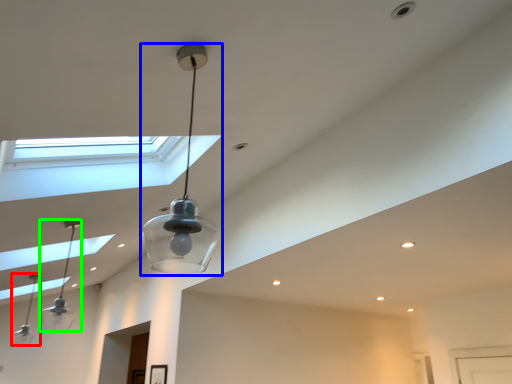
Question: Based on their relative distances, which object is nearer to lamp (highlighted by a red box)? Choose from lamp (highlighted by a blue box) and lamp (highlighted by a green box).

Choices:
 (A) lamp
 (B) lamp

Answer: (B)